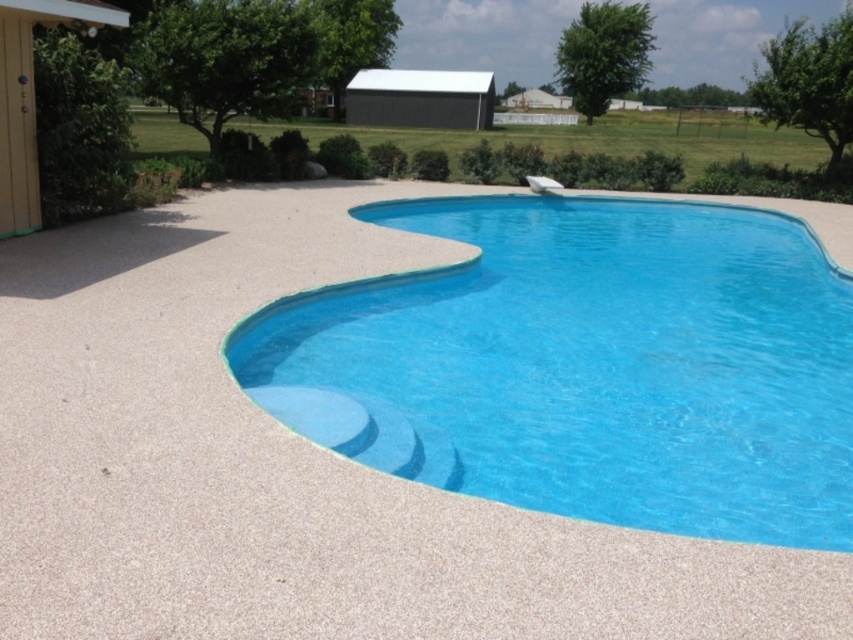
Does clear blue pool at center come in front of green grass at upper center?

Yes.

Does clear blue pool at center have a smaller size compared to green grass at upper center?

Correct, clear blue pool at center occupies less space than green grass at upper center.

Describe the element at coordinates (589, 365) in the screenshot. I see `clear blue pool at center` at that location.

Locate an element on the screen. clear blue pool at center is located at coordinates (589, 365).